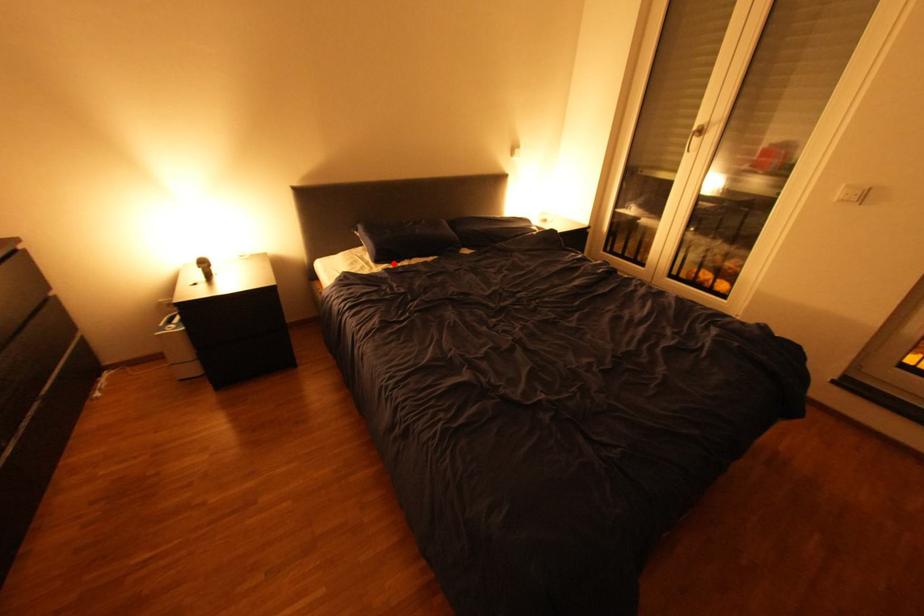
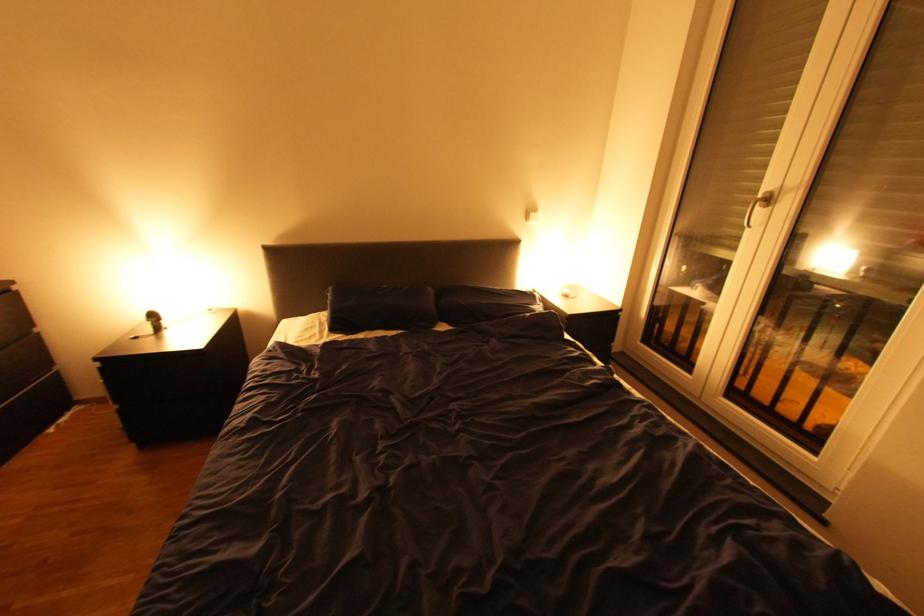
Find the pixel in the second image that matches the highlighted location in the first image.

(348, 333)